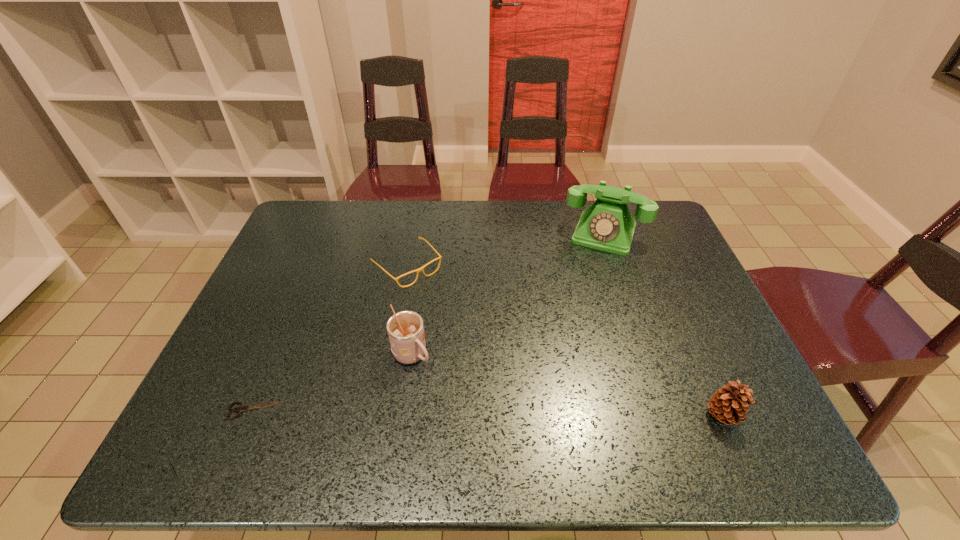
Point out which object is positioned as the third nearest to the cup. Please provide its 2D coordinates. Your answer should be formatted as a tuple, i.e. [(x, y)], where the tuple contains the x and y coordinates of a point satisfying the conditions above.

[(607, 225)]

Find the location of `the third closest object relative to the telephone`. the third closest object relative to the telephone is located at coordinates (405, 329).

The width and height of the screenshot is (960, 540). Find the location of `free space that satisfies the following two spatial constraints: 1. on the front side of the spectacles; 2. on the right side of the fourth shortest object`. free space that satisfies the following two spatial constraints: 1. on the front side of the spectacles; 2. on the right side of the fourth shortest object is located at coordinates (391, 356).

Image resolution: width=960 pixels, height=540 pixels. Find the location of `free spot that satisfies the following two spatial constraints: 1. on the back side of the fourth shortest object; 2. on the left side of the telephone`. free spot that satisfies the following two spatial constraints: 1. on the back side of the fourth shortest object; 2. on the left side of the telephone is located at coordinates (x=429, y=234).